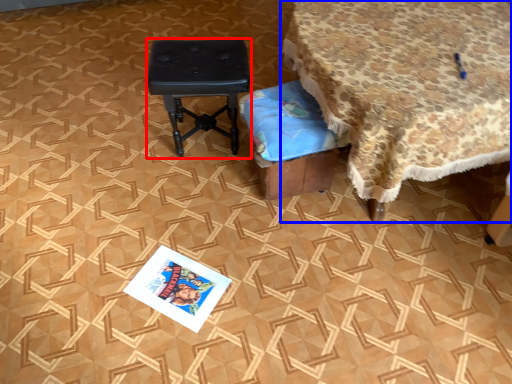
Question: Which of the following is the farthest to the observer, stool (highlighted by a red box) or table (highlighted by a blue box)?

Choices:
 (A) stool
 (B) table

Answer: (A)